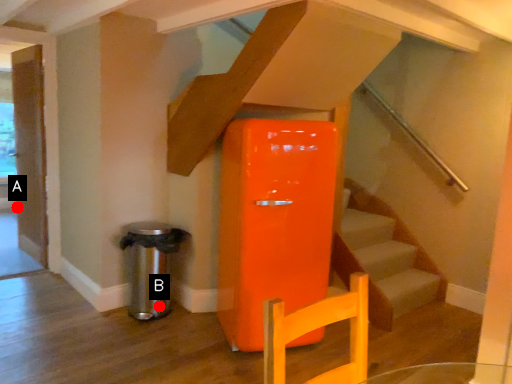
Question: Two points are circled on the image, labeled by A and B beside each circle. Which point is further to the camera?

Choices:
 (A) A is further
 (B) B is further

Answer: (A)